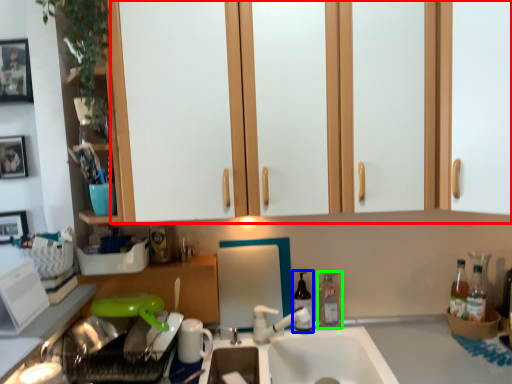
Question: Estimate the real-world distances between objects in this image. Which object is closer to dresser (highlighted by a red box), bottle (highlighted by a blue box) or bottle (highlighted by a green box)?

Choices:
 (A) bottle
 (B) bottle

Answer: (A)